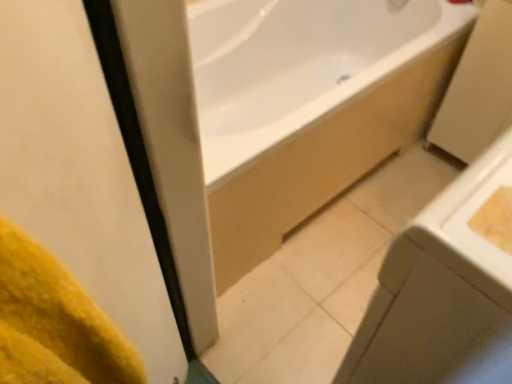
Locate an element on the screen. The image size is (512, 384). yellow fabric at left is located at coordinates (87, 172).

At what (x,y) coordinates should I click in order to perform the action: click on white glossy bathtub at upper center. Please return your answer as a coordinate pair (x, y). This screenshot has height=384, width=512. Looking at the image, I should click on (308, 106).

Based on the photo, measure the distance between white glossy sink at lower right and white glossy bathtub at upper center.

white glossy sink at lower right is 31.03 inches away from white glossy bathtub at upper center.

Is white glossy sink at lower right positioned with its back to white glossy bathtub at upper center?

No, white glossy sink at lower right's orientation is not away from white glossy bathtub at upper center.

Does white glossy sink at lower right have a smaller size compared to white glossy bathtub at upper center?

Correct, white glossy sink at lower right occupies less space than white glossy bathtub at upper center.

In order to click on bathtub below the white glossy sink at lower right (from a real-world perspective) in this screenshot , I will do (308, 106).

Is yellow fabric at left situated inside white glossy bathtub at upper center or outside?

yellow fabric at left lies outside white glossy bathtub at upper center.

In terms of width, does yellow fabric at left look wider or thinner when compared to white glossy bathtub at upper center?

Clearly, yellow fabric at left has less width compared to white glossy bathtub at upper center.

Is yellow fabric at left not near white glossy bathtub at upper center?

yellow fabric at left is near white glossy bathtub at upper center, not far away.

Where is `screen door that is on the left side of white glossy bathtub at upper center`? Image resolution: width=512 pixels, height=384 pixels. screen door that is on the left side of white glossy bathtub at upper center is located at coordinates (87, 172).

Could you tell me if yellow fabric at left is facing white glossy sink at lower right?

Yes, yellow fabric at left is aimed at white glossy sink at lower right.

Is yellow fabric at left positioned far away from white glossy sink at lower right?

No, yellow fabric at left is in close proximity to white glossy sink at lower right.

Does yellow fabric at left lie behind white glossy sink at lower right?

No, yellow fabric at left is closer to the camera.

Which is in front, point (0, 122) or point (403, 350)?

The point (0, 122) is closer to the camera.

Is white glossy sink at lower right further to camera compared to yellow fabric at left?

That is True.

Can you tell me how much white glossy sink at lower right and yellow fabric at left differ in facing direction?

139 degrees.

Would you say white glossy sink at lower right is inside or outside yellow fabric at left?

white glossy sink at lower right exists outside the volume of yellow fabric at left.

Is white glossy sink at lower right facing towards yellow fabric at left?

No, white glossy sink at lower right does not turn towards yellow fabric at left.

Between white glossy bathtub at upper center and yellow fabric at left, which one has larger width?

white glossy bathtub at upper center.

Which of these two, white glossy bathtub at upper center or yellow fabric at left, is bigger?

Bigger between the two is white glossy bathtub at upper center.

Is white glossy bathtub at upper center inside the boundaries of yellow fabric at left, or outside?

white glossy bathtub at upper center is located beyond the bounds of yellow fabric at left.

Based on their positions, is white glossy bathtub at upper center located to the left or right of yellow fabric at left?

Clearly, white glossy bathtub at upper center is on the right of yellow fabric at left in the image.

You are a GUI agent. You are given a task and a screenshot of the screen. Output one action in this format:
    pyautogui.click(x=<x>, y=<y>)
    Task: Click on the sink above the white glossy bathtub at upper center (from a real-world perspective)
    
    Given the screenshot: What is the action you would take?
    pyautogui.click(x=437, y=287)

Considering the sizes of objects white glossy bathtub at upper center and white glossy sink at lower right in the image provided, who is bigger, white glossy bathtub at upper center or white glossy sink at lower right?

Bigger between the two is white glossy bathtub at upper center.

Is white glossy bathtub at upper center facing away from white glossy sink at lower right?

white glossy bathtub at upper center is not turned away from white glossy sink at lower right.

Considering the positions of objects white glossy bathtub at upper center and white glossy sink at lower right in the image provided, who is behind, white glossy bathtub at upper center or white glossy sink at lower right?

white glossy bathtub at upper center is further from the camera.

Locate an element on the screen. sink that is on the right side of white glossy bathtub at upper center is located at coordinates (437, 287).

This screenshot has width=512, height=384. In order to click on bathtub behind the yellow fabric at left in this screenshot , I will do click(308, 106).

Considering their positions, is white glossy bathtub at upper center positioned closer to yellow fabric at left than white glossy sink at lower right?

white glossy sink at lower right.

When comparing their distances from yellow fabric at left, does white glossy sink at lower right or white glossy bathtub at upper center seem closer?

white glossy sink at lower right is closer to yellow fabric at left.

From the image, which object appears to be farther from white glossy bathtub at upper center, white glossy sink at lower right or yellow fabric at left?

Among the two, yellow fabric at left is located further to white glossy bathtub at upper center.

From the image, which object appears to be nearer to white glossy sink at lower right, yellow fabric at left or white glossy bathtub at upper center?

yellow fabric at left.

When comparing their distances from white glossy bathtub at upper center, does yellow fabric at left or white glossy sink at lower right seem further?

yellow fabric at left is further to white glossy bathtub at upper center.

Based on their spatial positions, is white glossy bathtub at upper center or yellow fabric at left closer to white glossy sink at lower right?

yellow fabric at left.

Locate an element on the screen. The height and width of the screenshot is (384, 512). sink between yellow fabric at left and white glossy bathtub at upper center from front to back is located at coordinates point(437,287).